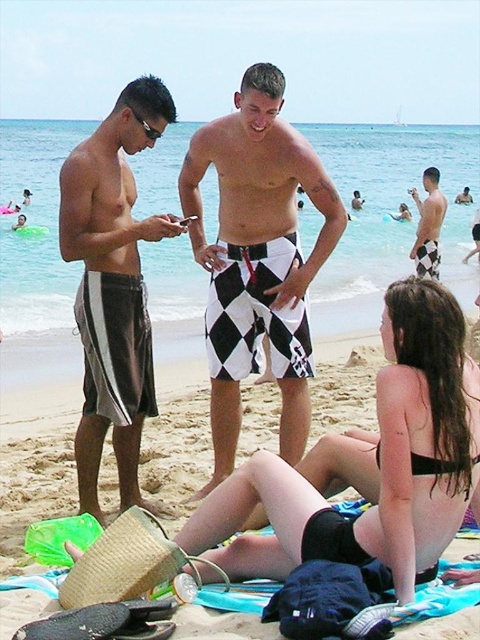
Question: Can you confirm if brown striped shorts at left is bigger than checkered shorts at center?

Choices:
 (A) no
 (B) yes

Answer: (A)

Question: Among these points, which one is nearest to the camera?

Choices:
 (A) (88, 301)
 (B) (264, 147)
 (C) (443, 208)
 (D) (453, 401)

Answer: (D)

Question: Is black checkered shorts at center below brown striped shorts at left?

Choices:
 (A) yes
 (B) no

Answer: (A)

Question: Does black checkered shorts at center have a greater width compared to checkered shorts at center?

Choices:
 (A) yes
 (B) no

Answer: (B)

Question: Based on their relative distances, which object is nearer to the brown striped shorts at left?

Choices:
 (A) checkered shorts at center
 (B) black matte bikini bottom at lower center

Answer: (B)

Question: Which object is the closest to the checkered shorts at center?

Choices:
 (A) brown striped shorts at left
 (B) black matte bikini bottom at lower center

Answer: (B)